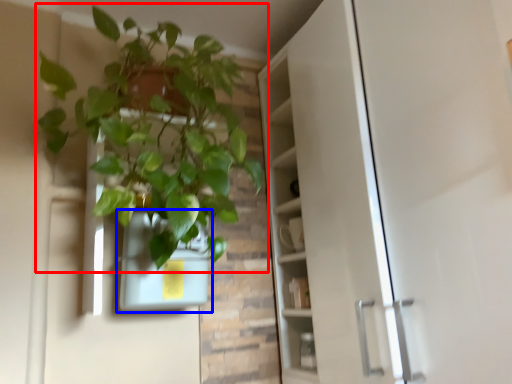
Question: Which object is further to the camera taking this photo, houseplant (highlighted by a red box) or flowerpot (highlighted by a blue box)?

Choices:
 (A) houseplant
 (B) flowerpot

Answer: (B)